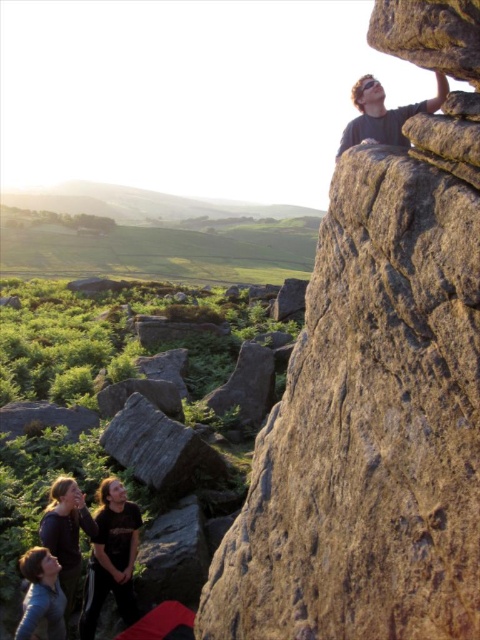
Question: Considering the real-world distances, which object is closest to the matte black shirt at upper right?

Choices:
 (A) blue denim jacket at lower left
 (B) dark brown leather jacket at lower left

Answer: (B)

Question: Where is matte black shirt at upper right located in relation to blue denim jacket at lower left in the image?

Choices:
 (A) below
 (B) above

Answer: (B)

Question: Can you confirm if rough textured rock at upper right is positioned to the left of blue denim jacket at lower left?

Choices:
 (A) no
 (B) yes

Answer: (A)

Question: Which point is closer to the camera?

Choices:
 (A) dark brown leather jacket at lower left
 (B) dark blue shirt at lower left
 (C) blue denim jacket at lower left
 (D) rough textured rock at upper right

Answer: (D)

Question: Does dark blue shirt at lower left come in front of blue denim jacket at lower left?

Choices:
 (A) yes
 (B) no

Answer: (B)

Question: Which point appears closest to the camera in this image?

Choices:
 (A) (113, 596)
 (B) (38, 572)
 (C) (388, 122)

Answer: (B)